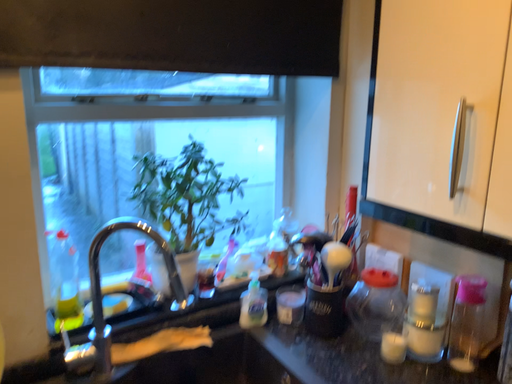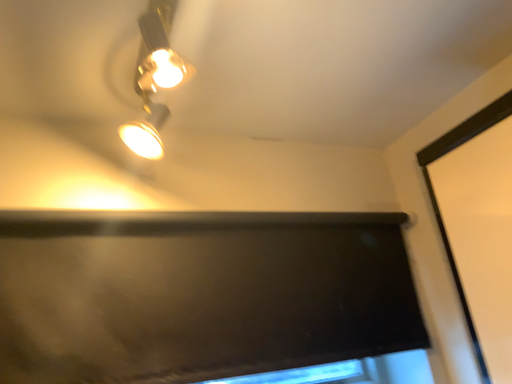
Question: Which way did the camera rotate in the video?

Choices:
 (A) rotated left
 (B) rotated right

Answer: (A)